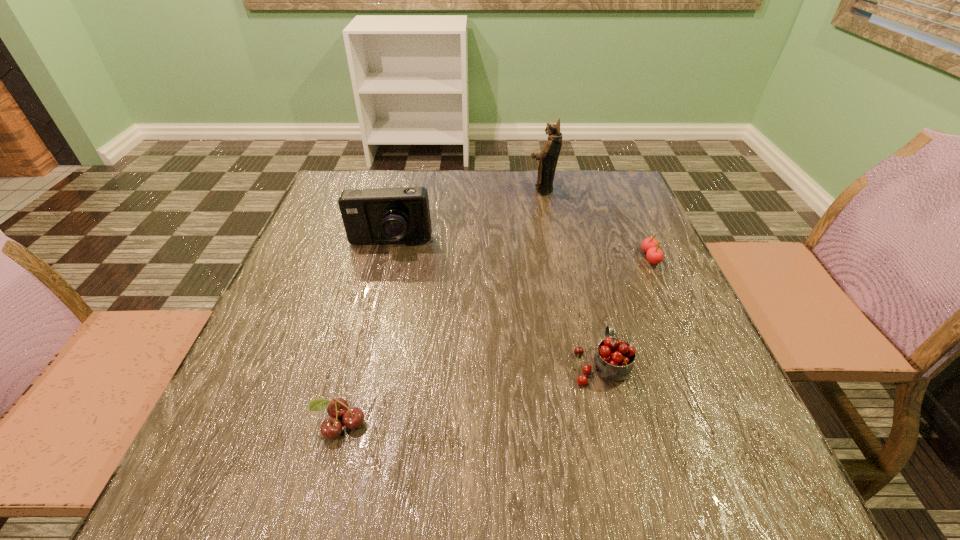
Find the location of a particular element. This screenshot has height=540, width=960. free spot that satisfies the following two spatial constraints: 1. on the front-facing side of the fourth shortest object; 2. on the right side of the rightmost cherry is located at coordinates (386, 257).

Identify the location of vacant area in the image that satisfies the following two spatial constraints: 1. on the front-facing side of the camera; 2. on the left side of the rightmost cherry. (386, 257).